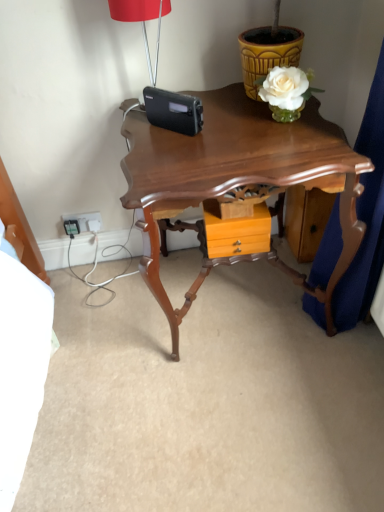
Identify the location of empty space that is ontop of shiny brown wooden table at center (from a real-world perspective). This screenshot has height=512, width=384. (244, 122).